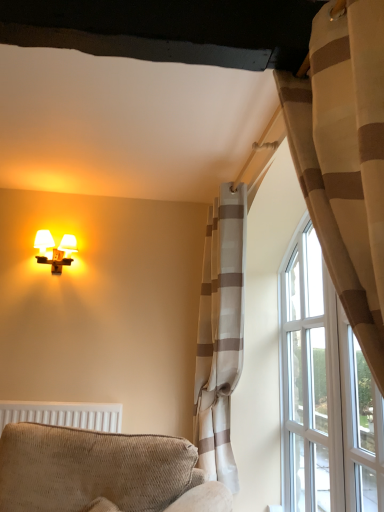
Question: From the image's perspective, relative to textured beige armchair at lower left, is beige striped curtain at right, arranged as the first curtain when viewed from the front, above or below?

Choices:
 (A) above
 (B) below

Answer: (A)

Question: Visually, is beige striped curtain at right, arranged as the first curtain when viewed from the front, positioned to the left or to the right of textured beige armchair at lower left?

Choices:
 (A) right
 (B) left

Answer: (A)

Question: Based on their relative distances, which object is nearer to the beige striped curtain at right, arranged as the second curtain when viewed from the back?

Choices:
 (A) light beige striped curtain at upper right, which is the 1th curtain in back-to-front order
 (B) white textured radiator at lower left
 (C) clear glass door at right
 (D) white glass window at upper right
 (E) matte white wall sconce at upper left

Answer: (C)

Question: Which is farther from the matte white wall sconce at upper left?

Choices:
 (A) white glass window at upper right
 (B) light beige striped curtain at upper right, which is the 2th curtain in front-to-back order
 (C) textured beige armchair at lower left
 (D) clear glass door at right
 (E) beige striped curtain at right, arranged as the first curtain when viewed from the front

Answer: (E)